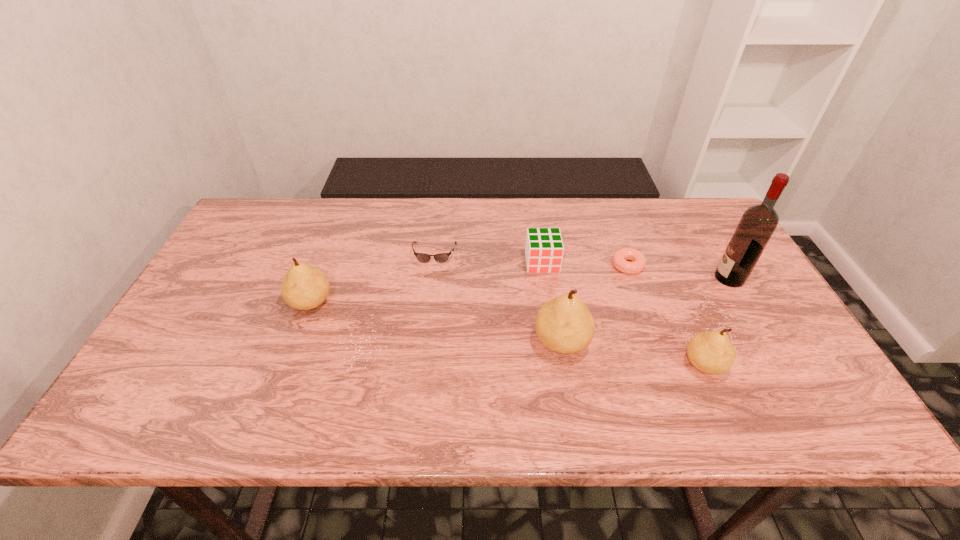
Where is `sunglasses`? This screenshot has width=960, height=540. sunglasses is located at coordinates (421, 257).

Identify the location of the second object from left to right. This screenshot has width=960, height=540. (421, 257).

Where is `vacant space located 0.140m on the right of the fifth shortest object`? Image resolution: width=960 pixels, height=540 pixels. vacant space located 0.140m on the right of the fifth shortest object is located at coordinates (386, 302).

Image resolution: width=960 pixels, height=540 pixels. Identify the location of vacant space located 0.260m on the right of the second pear from left to right. (697, 342).

In order to click on vacant area situated on the right of the rightmost pear in this screenshot , I will do `click(785, 364)`.

The width and height of the screenshot is (960, 540). What are the coordinates of `vacant area situated 0.350m on the front and back of the rightmost object` in the screenshot? It's located at (589, 278).

Where is `vacant space located on the front and back of the rightmost object`? Image resolution: width=960 pixels, height=540 pixels. vacant space located on the front and back of the rightmost object is located at coordinates (643, 278).

The height and width of the screenshot is (540, 960). Find the location of `free space located 0.190m on the front and back of the rightmost object`. free space located 0.190m on the front and back of the rightmost object is located at coordinates (646, 278).

Find the location of `vacant space located on the front of the doughnut`. vacant space located on the front of the doughnut is located at coordinates (643, 308).

The height and width of the screenshot is (540, 960). What are the coordinates of `free region located 0.320m on the red face of the cube` in the screenshot? It's located at (558, 370).